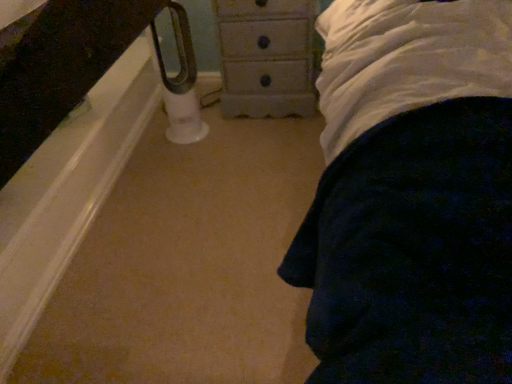
Image resolution: width=512 pixels, height=384 pixels. What do you see at coordinates (179, 81) in the screenshot?
I see `white plastic towel bar at lower left` at bounding box center [179, 81].

Locate an element on the screen. The image size is (512, 384). white plastic towel bar at lower left is located at coordinates (179, 81).

Find the location of a particular element. Image resolution: width=512 pixels, height=384 pixels. white painted wood chest of drawers at center is located at coordinates (266, 57).

What do you see at coordinates (266, 57) in the screenshot? I see `white painted wood chest of drawers at center` at bounding box center [266, 57].

At what (x,y) coordinates should I click in order to perform the action: click on white plastic towel bar at lower left. Please return your answer as a coordinate pair (x, y). This screenshot has width=512, height=384. Looking at the image, I should click on (179, 81).

Based on the photo, can you confirm if white plastic towel bar at lower left is positioned to the right of white painted wood chest of drawers at center?

No, white plastic towel bar at lower left is not to the right of white painted wood chest of drawers at center.

Is white plastic towel bar at lower left in front of white painted wood chest of drawers at center?

Yes, the depth of white plastic towel bar at lower left is less than that of white painted wood chest of drawers at center.

Between point (188, 61) and point (285, 27), which one is positioned behind?

Positioned behind is point (188, 61).

From the image's perspective, is white plastic towel bar at lower left located above or below white painted wood chest of drawers at center?

white plastic towel bar at lower left is below white painted wood chest of drawers at center.

From a real-world perspective, between white plastic towel bar at lower left and white painted wood chest of drawers at center, who is vertically higher?

In real-world perspective, white plastic towel bar at lower left is above.

Between white plastic towel bar at lower left and white painted wood chest of drawers at center, which one has larger width?

Wider between the two is white painted wood chest of drawers at center.

Considering the sizes of objects white plastic towel bar at lower left and white painted wood chest of drawers at center in the image provided, who is shorter, white plastic towel bar at lower left or white painted wood chest of drawers at center?

white painted wood chest of drawers at center is shorter.

Who is smaller, white plastic towel bar at lower left or white painted wood chest of drawers at center?

With smaller size is white plastic towel bar at lower left.

Is white plastic towel bar at lower left not inside white painted wood chest of drawers at center?

Yes.

Is white plastic towel bar at lower left not close to white painted wood chest of drawers at center?

They are positioned close to each other.

Is white plastic towel bar at lower left positioned with its back to white painted wood chest of drawers at center?

That's not correct — white plastic towel bar at lower left is not looking away from white painted wood chest of drawers at center.

Measure the distance from white plastic towel bar at lower left to white painted wood chest of drawers at center.

white plastic towel bar at lower left and white painted wood chest of drawers at center are 11.71 inches apart.

Locate an element on the screen. The image size is (512, 384). towel bar above the white painted wood chest of drawers at center (from a real-world perspective) is located at coordinates (179, 81).

Looking at this image, is white painted wood chest of drawers at center at the right side of white plastic towel bar at lower left?

Indeed, white painted wood chest of drawers at center is positioned on the right side of white plastic towel bar at lower left.

Which object is closer to the camera taking this photo, white painted wood chest of drawers at center or white plastic towel bar at lower left?

white plastic towel bar at lower left.

Considering the positions of points (307, 61) and (201, 134), is point (307, 61) closer to camera compared to point (201, 134)?

Yes, point (307, 61) is closer to viewer.

From the image's perspective, does white painted wood chest of drawers at center appear lower than white plastic towel bar at lower left?

No, from the image's perspective, white painted wood chest of drawers at center is not beneath white plastic towel bar at lower left.

From a real-world perspective, who is located lower, white painted wood chest of drawers at center or white plastic towel bar at lower left?

white painted wood chest of drawers at center, from a real-world perspective.

Is white painted wood chest of drawers at center wider than white plastic towel bar at lower left?

Yes, white painted wood chest of drawers at center is wider than white plastic towel bar at lower left.

Between white painted wood chest of drawers at center and white plastic towel bar at lower left, which one has less height?

Standing shorter between the two is white painted wood chest of drawers at center.

Can you confirm if white painted wood chest of drawers at center is bigger than white plastic towel bar at lower left?

Indeed, white painted wood chest of drawers at center has a larger size compared to white plastic towel bar at lower left.

Is white painted wood chest of drawers at center completely or partially outside of white plastic towel bar at lower left?

white painted wood chest of drawers at center lies outside white plastic towel bar at lower left's area.

Based on the photo, is white painted wood chest of drawers at center with white plastic towel bar at lower left?

There is a gap between white painted wood chest of drawers at center and white plastic towel bar at lower left.

Based on the photo, could you tell me if white painted wood chest of drawers at center is turned towards white plastic towel bar at lower left?

No.

How different are the orientations of white painted wood chest of drawers at center and white plastic towel bar at lower left in degrees?

39.1 degrees.

You are a GUI agent. You are given a task and a screenshot of the screen. Output one action in this format:
    pyautogui.click(x=<x>, y=<y>)
    Task: Click on the chest of drawers behind the white plastic towel bar at lower left
    
    Given the screenshot: What is the action you would take?
    pyautogui.click(x=266, y=57)

Locate an element on the screen. The width and height of the screenshot is (512, 384). towel bar that appears on the left of white painted wood chest of drawers at center is located at coordinates (179, 81).

Identify the location of the chest of drawers that appears behind the white plastic towel bar at lower left. This screenshot has width=512, height=384. (266, 57).